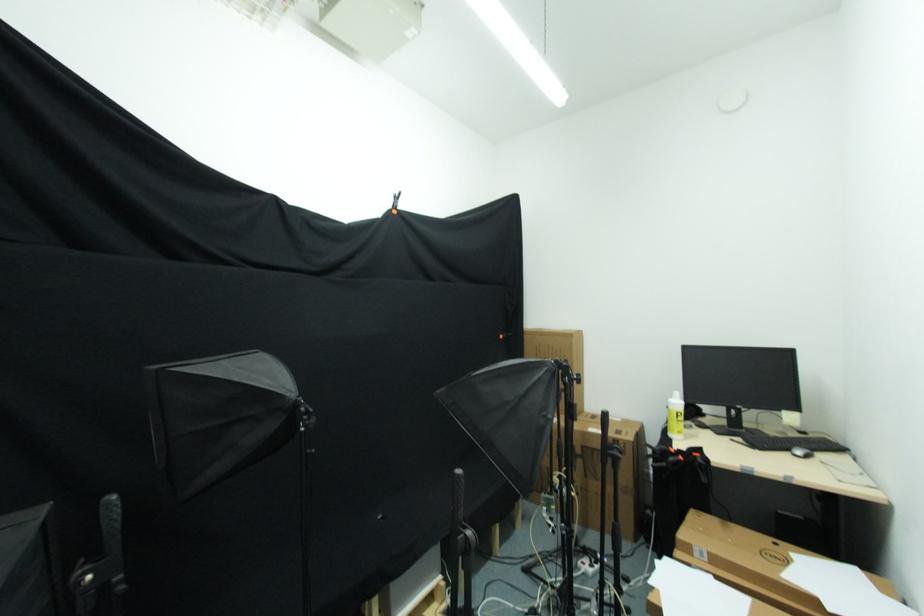
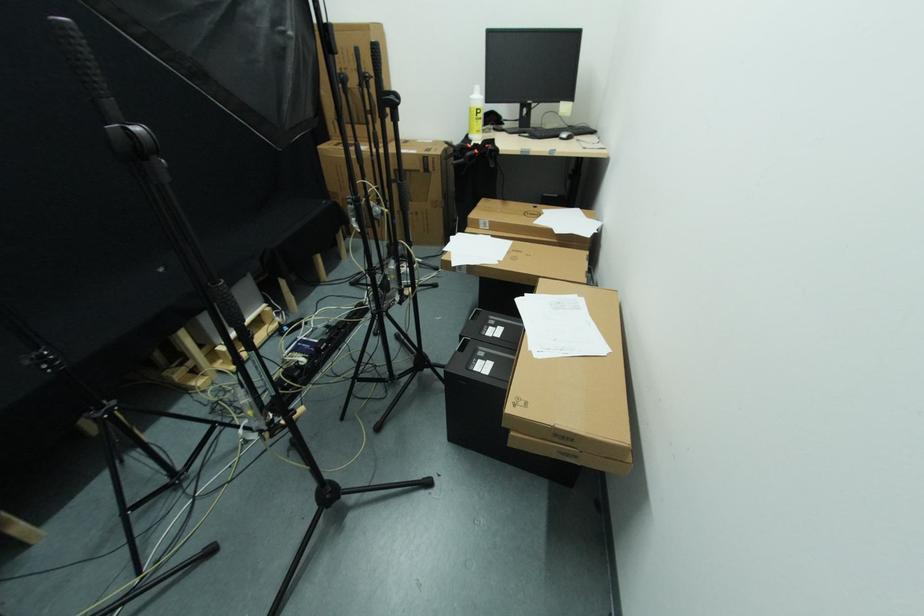
In the second image, find the point that corresponds to (792,454) in the first image.

(561, 139)